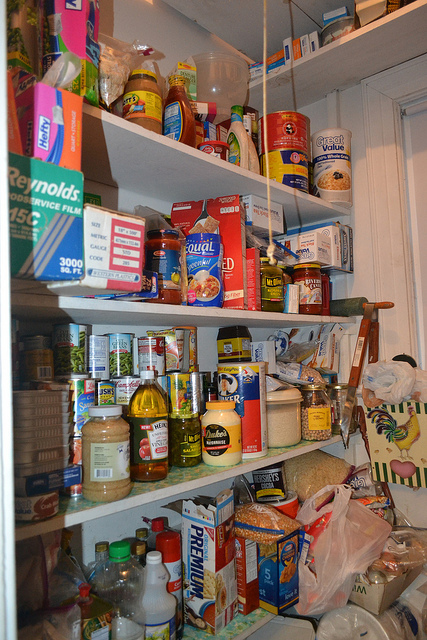
The width and height of the screenshot is (427, 640). Identify the location of box. (193, 570).